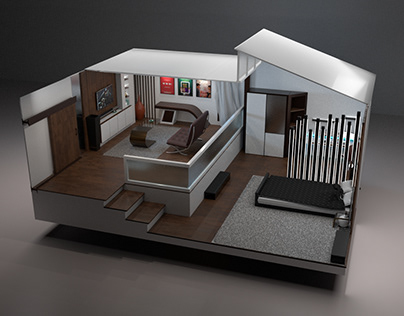
Locate an element on the screen. terra cotta pot in the back left corner is located at coordinates (141, 109).